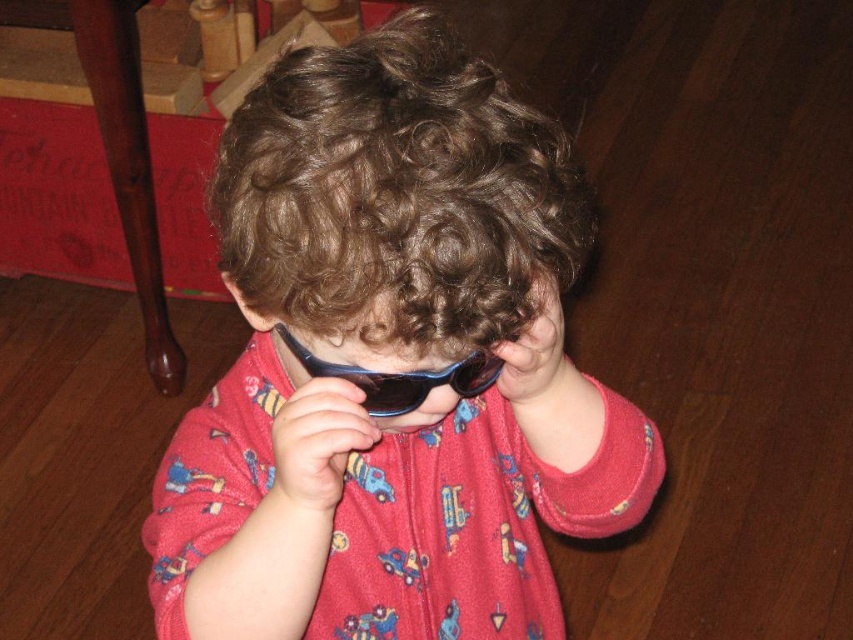
Question: Which object appears farthest from the camera in this image?

Choices:
 (A) blue plastic sunglasses at center
 (B) brown curly hair at center

Answer: (A)

Question: Which of the following is the closest to the observer?

Choices:
 (A) (471, 90)
 (B) (285, 328)
 (C) (561, 512)

Answer: (A)

Question: Does matte plastic sunglasses at center lie in front of brown curly hair at center?

Choices:
 (A) yes
 (B) no

Answer: (B)

Question: Which object is closer to the camera taking this photo?

Choices:
 (A) brown curly hair at center
 (B) matte plastic sunglasses at center

Answer: (A)

Question: Does brown curly hair at center come behind blue plastic sunglasses at center?

Choices:
 (A) no
 (B) yes

Answer: (A)

Question: Does matte plastic sunglasses at center appear over brown curly hair at center?

Choices:
 (A) yes
 (B) no

Answer: (B)